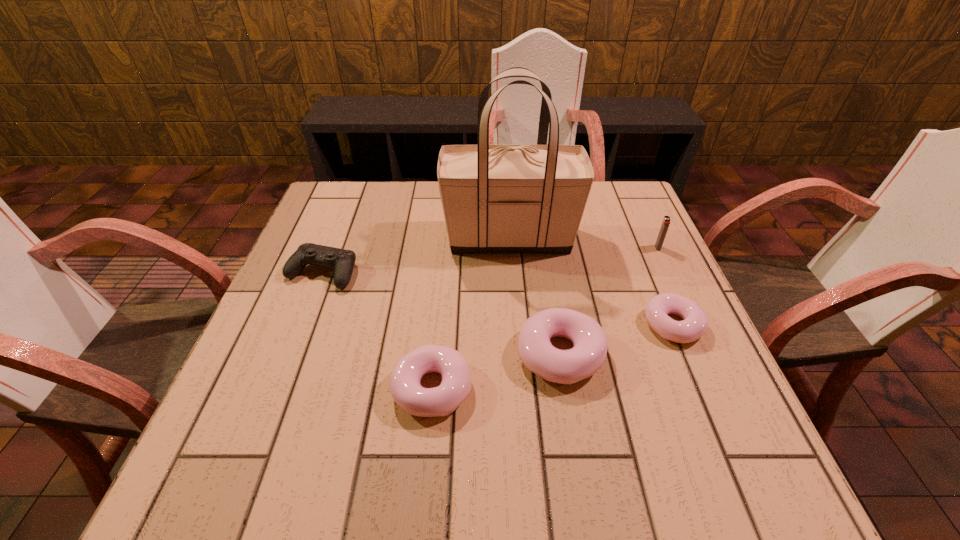
The width and height of the screenshot is (960, 540). In order to click on empty space that is in between the second doughnut from left to right and the shopping bag in this screenshot , I will do `click(535, 296)`.

Image resolution: width=960 pixels, height=540 pixels. In order to click on free space between the second doughnut from left to right and the rightmost doughnut in this screenshot , I will do `click(616, 340)`.

This screenshot has width=960, height=540. I want to click on vacant space in between the tallest object and the leftmost object, so click(x=416, y=255).

The image size is (960, 540). In order to click on free space between the second doughnut from left to right and the shortest object in this screenshot , I will do `click(616, 340)`.

Where is `the fourth closest object to the control`? The width and height of the screenshot is (960, 540). the fourth closest object to the control is located at coordinates (695, 322).

Point out which object is positioned as the fourth nearest to the leftmost doughnut. Please provide its 2D coordinates. Your answer should be formatted as a tuple, i.e. [(x, y)], where the tuple contains the x and y coordinates of a point satisfying the conditions above.

[(695, 322)]

Identify which doughnut is the second closest to the leftmost doughnut. Please provide its 2D coordinates. Your answer should be formatted as a tuple, i.e. [(x, y)], where the tuple contains the x and y coordinates of a point satisfying the conditions above.

[(695, 322)]

The height and width of the screenshot is (540, 960). Find the location of `the closest doughnut relative to the shopping bag`. the closest doughnut relative to the shopping bag is located at coordinates (695, 322).

Locate an element on the screen. vacant position in the image that satisfies the following two spatial constraints: 1. on the back side of the igniter; 2. on the right side of the leftmost object is located at coordinates (332, 248).

Identify the location of free location that satisfies the following two spatial constraints: 1. on the back side of the rightmost doughnut; 2. with handles facing forward on the shopping bag. Image resolution: width=960 pixels, height=540 pixels. (636, 239).